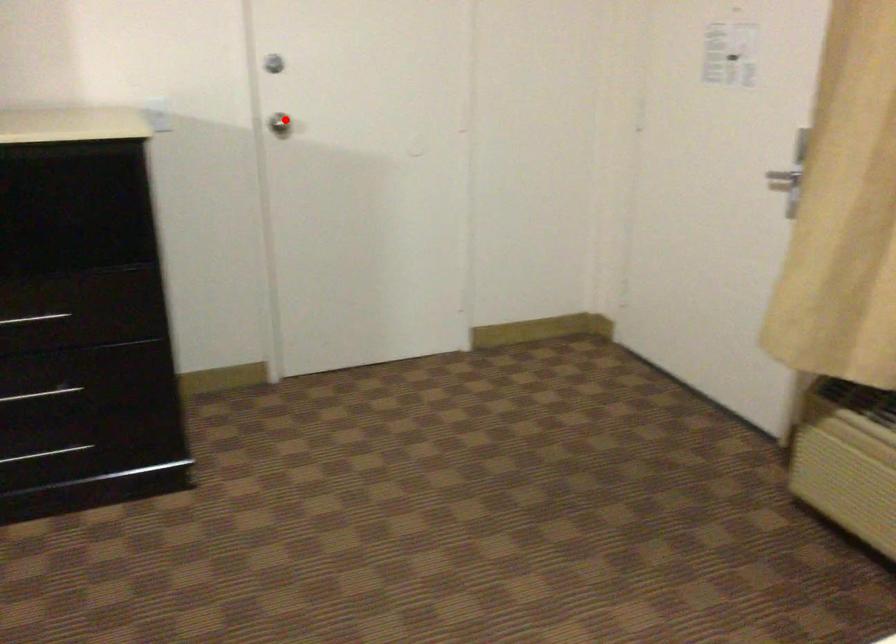
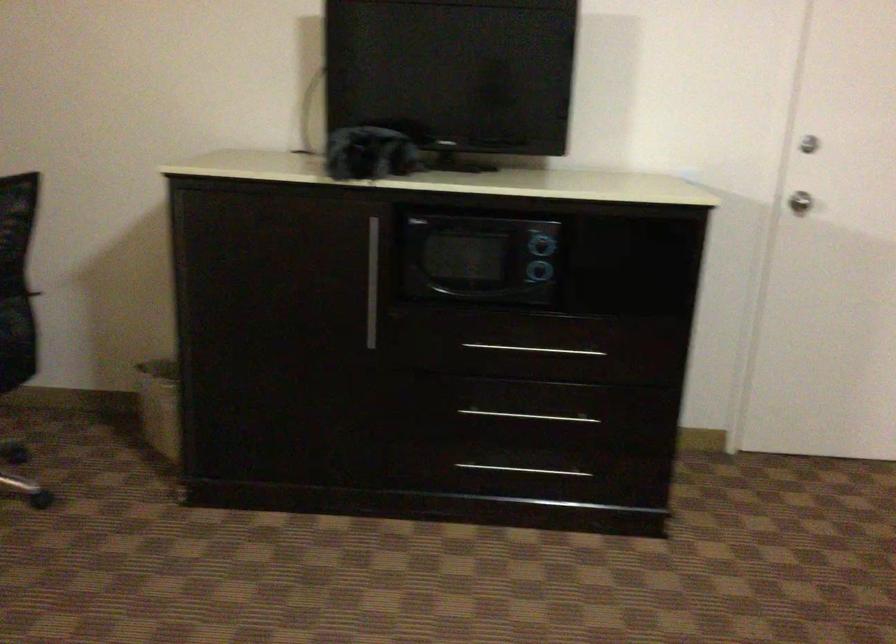
Question: I am providing you with two images of the same scene from different viewpoints. A red point is marked on the first image. Can you still see the location of the red point in image 2?

Choices:
 (A) Yes
 (B) No

Answer: (A)